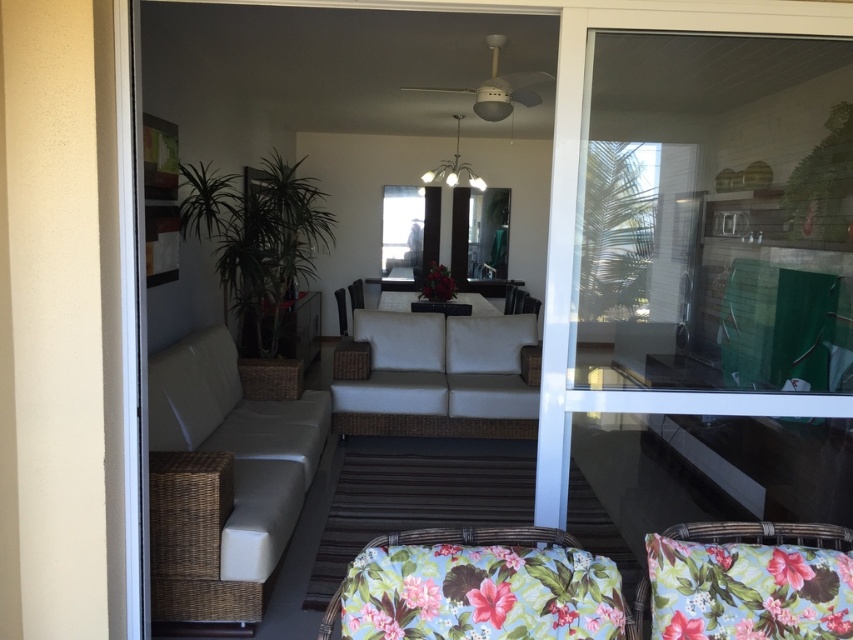
This screenshot has width=853, height=640. Find the location of `white leather couch at center`. white leather couch at center is located at coordinates (225, 474).

Locate an element on the screen. The image size is (853, 640). white leather couch at center is located at coordinates (225, 474).

In order to click on white leather couch at center in this screenshot , I will do click(225, 474).

The height and width of the screenshot is (640, 853). Find the location of `white leather couch at center`. white leather couch at center is located at coordinates (225, 474).

What do you see at coordinates (225, 474) in the screenshot? Image resolution: width=853 pixels, height=640 pixels. I see `white leather couch at center` at bounding box center [225, 474].

Where is `white leather couch at center`? The image size is (853, 640). white leather couch at center is located at coordinates (225, 474).

Who is lower down, transparent glass screen door at right or white wicker couch at center?

white wicker couch at center

Identify the location of transparent glass screen door at right. (717, 276).

Find the location of a particular element. The image size is (853, 640). transparent glass screen door at right is located at coordinates [717, 276].